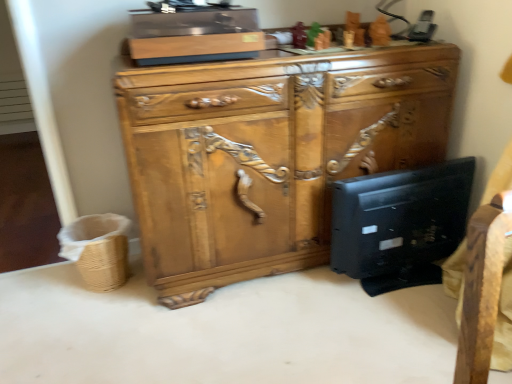
Question: Considering the positions of black matte desktop computer at lower right and wooden carved cabinet at center in the image, is black matte desktop computer at lower right wider or thinner than wooden carved cabinet at center?

Choices:
 (A) wide
 (B) thin

Answer: (B)

Question: In the image, is black matte desktop computer at lower right on the left side or the right side of wooden carved cabinet at center?

Choices:
 (A) right
 (B) left

Answer: (A)

Question: Estimate the real-world distances between objects in this image. Which object is farther from the wooden carved cabinet at center?

Choices:
 (A) woven brown basket at lower left
 (B) black matte desktop computer at lower right

Answer: (A)

Question: Which is farther from the woven brown basket at lower left?

Choices:
 (A) wooden carved cabinet at center
 (B) black matte desktop computer at lower right

Answer: (B)